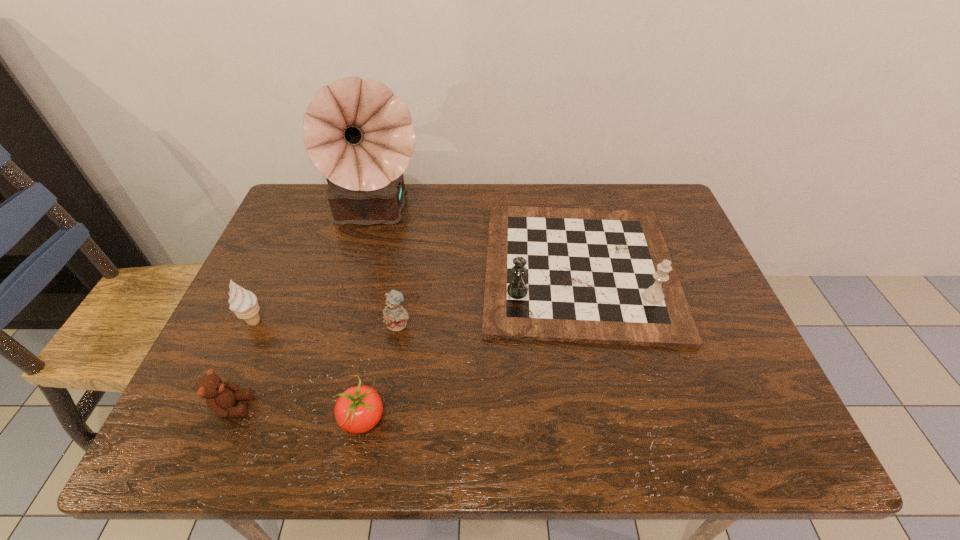
Find the location of `vacant position located on the face of the left teddy bear`. vacant position located on the face of the left teddy bear is located at coordinates (355, 407).

Find the location of a particular element. This screenshot has width=960, height=540. vacant position located 0.200m on the left of the shortest object is located at coordinates (238, 419).

Find the location of a particular element. The height and width of the screenshot is (540, 960). record player at the far edge is located at coordinates [358, 134].

You are a GUI agent. You are given a task and a screenshot of the screen. Output one action in this format:
    pyautogui.click(x=<x>, y=<y>)
    Task: Click on the gameboard that is at the far edge
    The image size is (960, 540).
    Given the screenshot: What is the action you would take?
    pyautogui.click(x=580, y=275)

Find the location of `teddy bear at the near edge`. teddy bear at the near edge is located at coordinates (220, 396).

In order to click on tomato at the near edge in this screenshot , I will do `click(358, 409)`.

Locate an element on the screen. The width and height of the screenshot is (960, 540). record player at the left edge is located at coordinates (358, 134).

At what (x,y) coordinates should I click in order to perform the action: click on icecream at the left edge. Please return your answer as a coordinate pair (x, y). The height and width of the screenshot is (540, 960). Looking at the image, I should click on (243, 303).

Find the location of a particular element. This screenshot has width=960, height=540. teddy bear that is at the left edge is located at coordinates (220, 396).

The width and height of the screenshot is (960, 540). In order to click on object located at the right edge in this screenshot , I will do `click(580, 275)`.